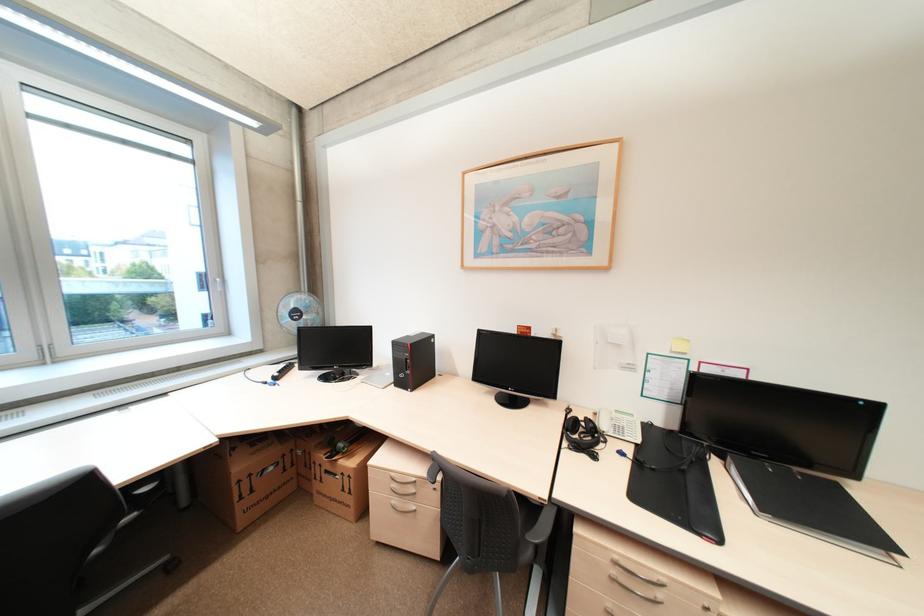
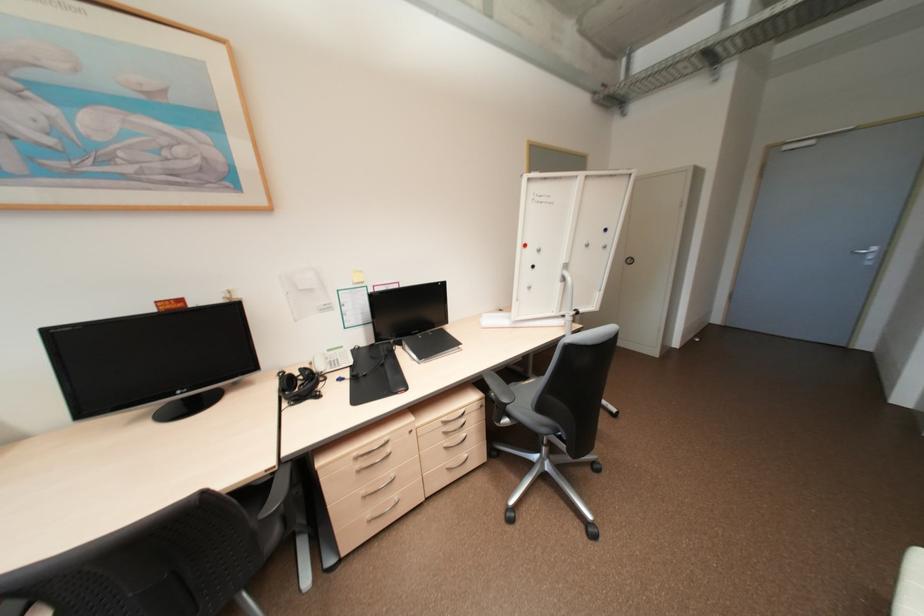
Locate, in the second image, the point that corresponds to the point at 622,557 in the first image.

(360, 454)